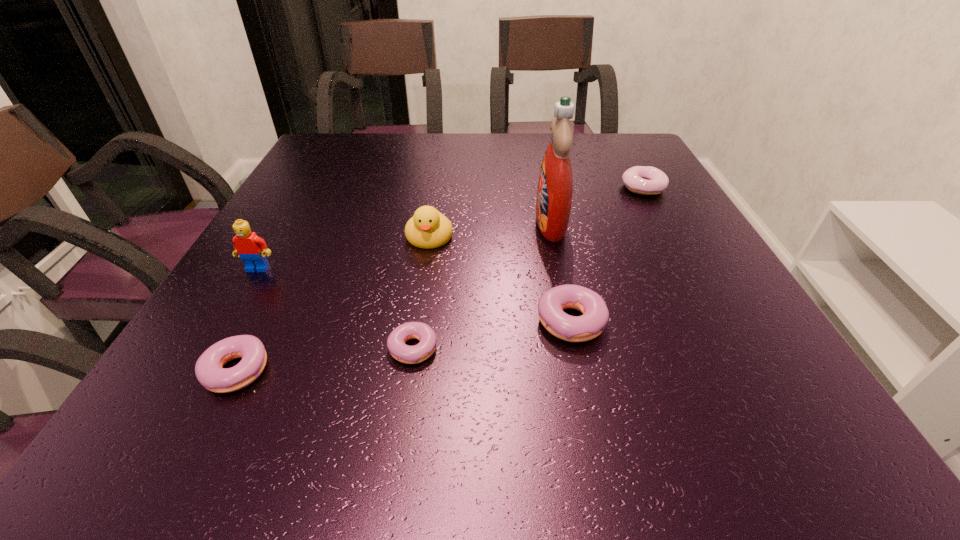
This screenshot has width=960, height=540. Find the location of `the third tallest doughnut`. the third tallest doughnut is located at coordinates (208, 369).

Where is `the second shortest object`? This screenshot has width=960, height=540. the second shortest object is located at coordinates (208, 369).

Identify the location of the shortest object. The width and height of the screenshot is (960, 540). (424, 333).

You are a GUI agent. You are given a task and a screenshot of the screen. Output one action in this format:
    pyautogui.click(x=<x>, y=<y>)
    Task: Click on the third doughnut from right to left
    
    Given the screenshot: What is the action you would take?
    pyautogui.click(x=424, y=333)

You are a GUI agent. You are given a task and a screenshot of the screen. Output one action in this format:
    pyautogui.click(x=<x>, y=<y>)
    Task: Click on the second doughnut from right to left
    
    Given the screenshot: What is the action you would take?
    pyautogui.click(x=591, y=324)

The width and height of the screenshot is (960, 540). I want to click on duckling, so click(x=428, y=228).

In order to click on the fourth nearest object in this screenshot , I will do `click(252, 249)`.

Find the location of a particular element. The image size is (960, 540). Lego is located at coordinates (252, 249).

You are a GUI agent. You are given a task and a screenshot of the screen. Output one action in this format:
    pyautogui.click(x=<x>, y=<y>)
    Task: Click on the rightmost object
    
    Given the screenshot: What is the action you would take?
    pyautogui.click(x=645, y=180)

Image resolution: width=960 pixels, height=540 pixels. What are the coordinates of `the rightmost doughnut` in the screenshot? It's located at (645, 180).